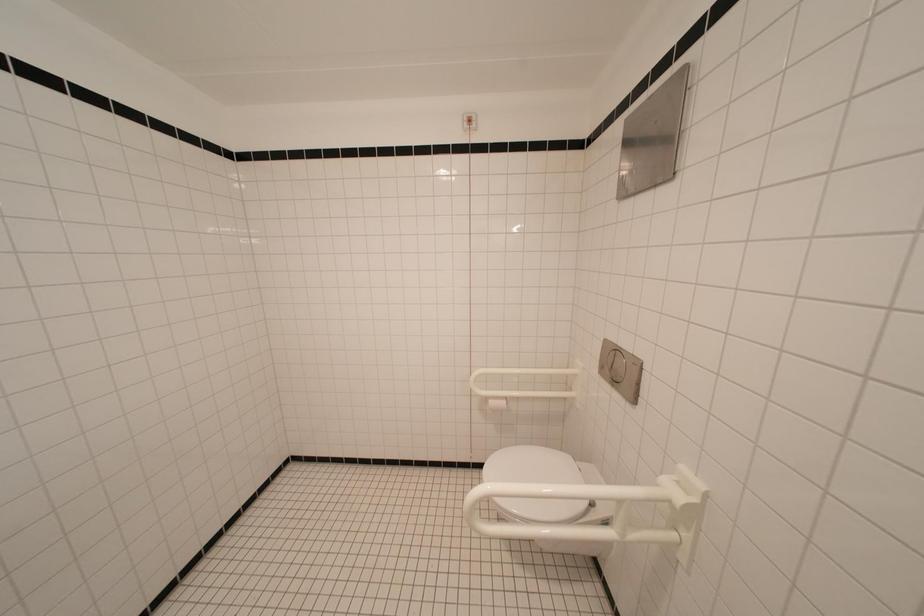
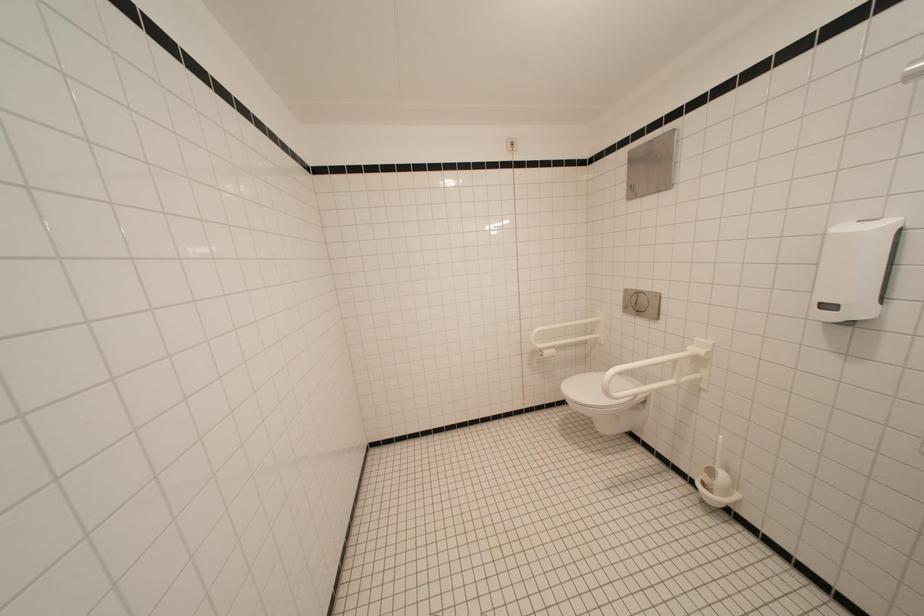
Question: The images are taken continuously from a first-person perspective. In which direction are you moving?

Choices:
 (A) Left
 (B) Right
 (C) Forward
 (D) Backward

Answer: (A)